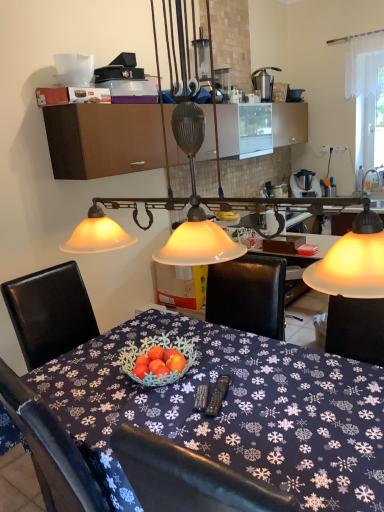
Question: Does brushed metal faucet at upper right have a lesser width compared to blue fabric tablecloth at center?

Choices:
 (A) no
 (B) yes

Answer: (B)

Question: Considering the relative sizes of brushed metal faucet at upper right and blue fabric tablecloth at center in the image provided, is brushed metal faucet at upper right wider than blue fabric tablecloth at center?

Choices:
 (A) yes
 (B) no

Answer: (B)

Question: Does brushed metal faucet at upper right come behind blue fabric tablecloth at center?

Choices:
 (A) yes
 (B) no

Answer: (A)

Question: Considering the relative sizes of brushed metal faucet at upper right and blue fabric tablecloth at center in the image provided, is brushed metal faucet at upper right taller than blue fabric tablecloth at center?

Choices:
 (A) no
 (B) yes

Answer: (A)

Question: Is brushed metal faucet at upper right at the left side of blue fabric tablecloth at center?

Choices:
 (A) no
 (B) yes

Answer: (A)

Question: Considering the relative positions of brushed metal faucet at upper right and blue fabric tablecloth at center in the image provided, is brushed metal faucet at upper right to the right of blue fabric tablecloth at center from the viewer's perspective?

Choices:
 (A) no
 (B) yes

Answer: (B)

Question: Are metallic silver juicer at upper right and brown matte cabinet at upper center located far from each other?

Choices:
 (A) no
 (B) yes

Answer: (B)

Question: From the image's perspective, is metallic silver juicer at upper right over brown matte cabinet at upper center?

Choices:
 (A) no
 (B) yes

Answer: (B)

Question: Is metallic silver juicer at upper right oriented away from brown matte cabinet at upper center?

Choices:
 (A) no
 (B) yes

Answer: (A)

Question: Considering the relative sizes of metallic silver juicer at upper right and brown matte cabinet at upper center in the image provided, is metallic silver juicer at upper right bigger than brown matte cabinet at upper center?

Choices:
 (A) no
 (B) yes

Answer: (A)

Question: Considering the relative sizes of metallic silver juicer at upper right and brown matte cabinet at upper center in the image provided, is metallic silver juicer at upper right shorter than brown matte cabinet at upper center?

Choices:
 (A) yes
 (B) no

Answer: (A)

Question: Can you confirm if metallic silver juicer at upper right is wider than brown matte cabinet at upper center?

Choices:
 (A) yes
 (B) no

Answer: (B)

Question: Does blue fabric tablecloth at center have a lesser height compared to brushed metal faucet at upper right?

Choices:
 (A) no
 (B) yes

Answer: (A)